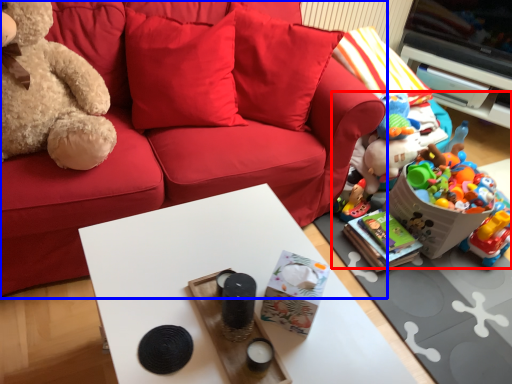
Question: Among these objects, which one is nearest to the camera, toy (highlighted by a red box) or studio couch (highlighted by a blue box)?

Choices:
 (A) toy
 (B) studio couch

Answer: (B)